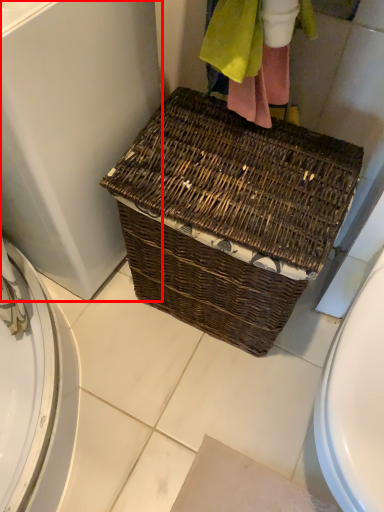
Question: From the image's perspective, where is screen door (annotated by the red box) located in relation to picnic basket in the image?

Choices:
 (A) below
 (B) above

Answer: (B)